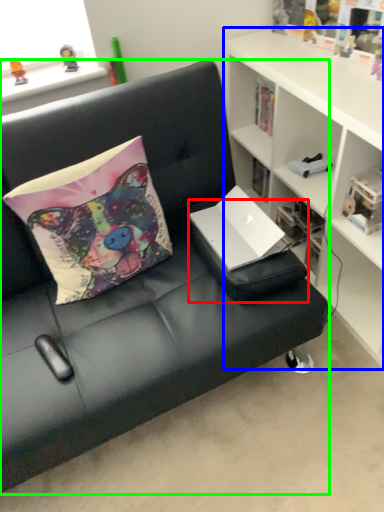
Question: Considering the real-world distances, which object is closest to footrest (highlighted by a red box)? cabinetry (highlighted by a blue box) or studio couch (highlighted by a green box).

Choices:
 (A) cabinetry
 (B) studio couch

Answer: (B)